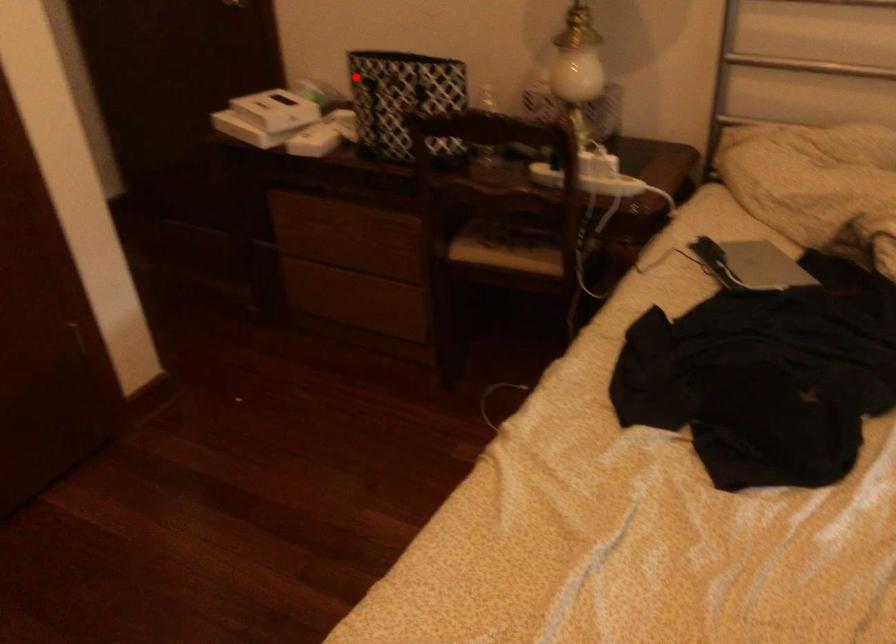
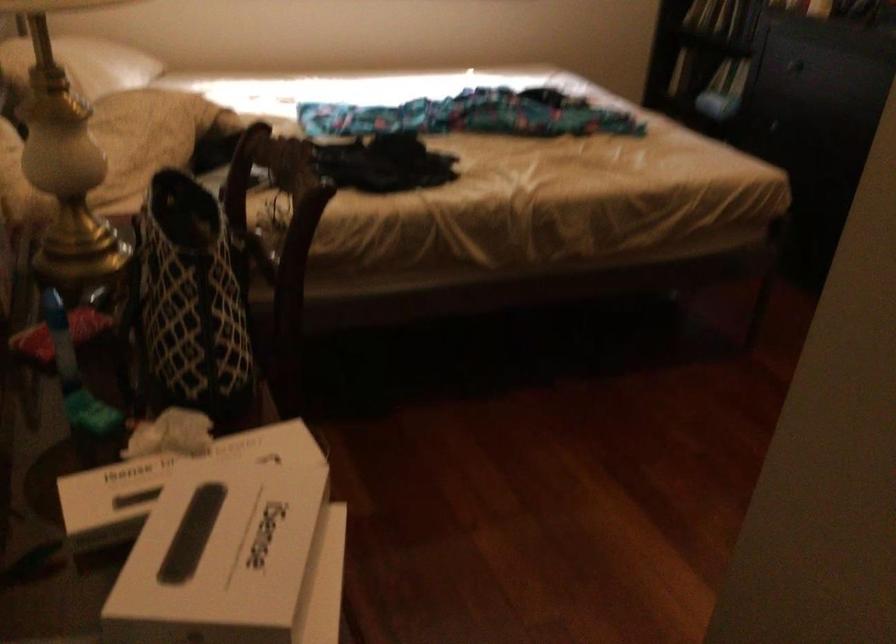
Question: I am providing you with two images of the same scene from different viewpoints. In image1, a red point is highlighted. Considering the same 3D point in image2, which of the following is correct?

Choices:
 (A) It is closer
 (B) It is farther

Answer: (A)